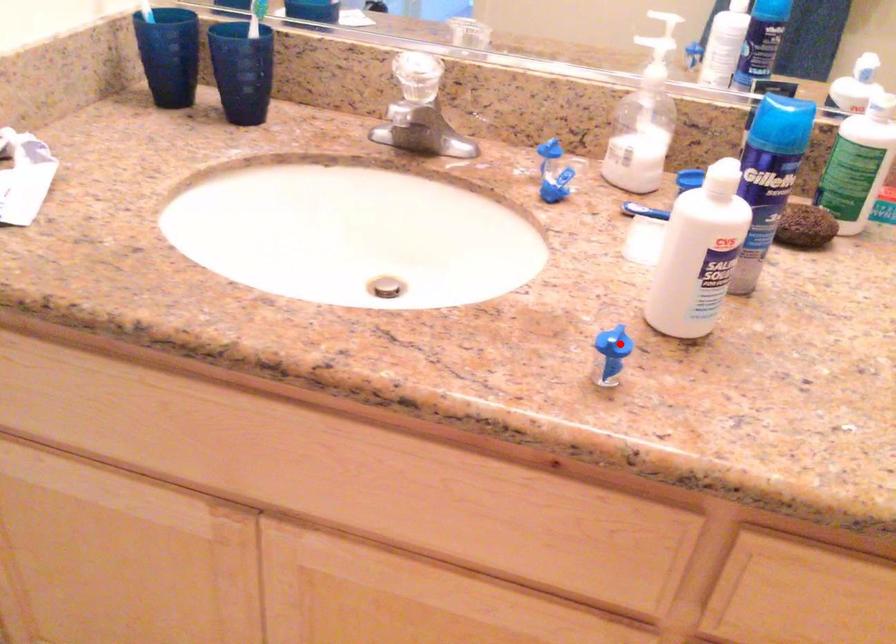
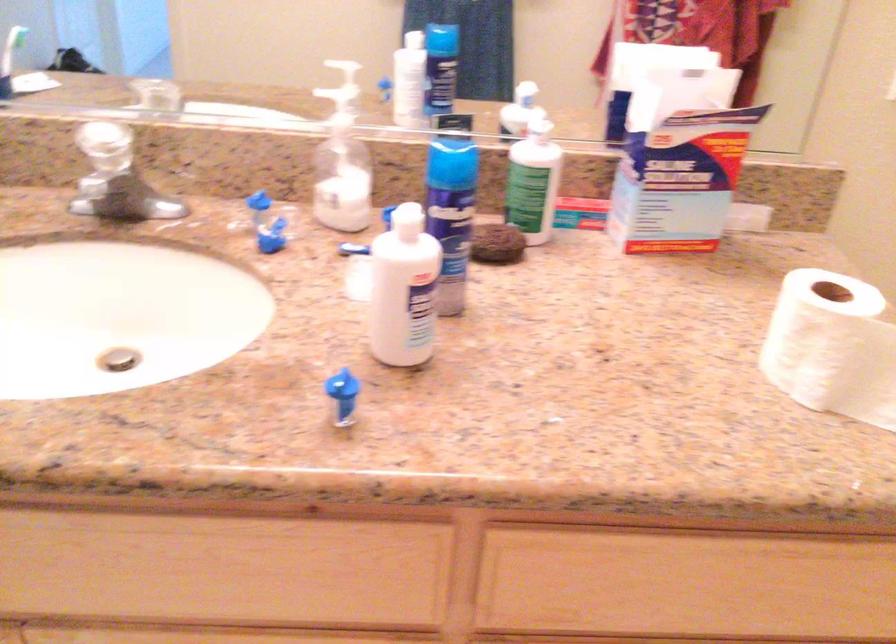
Locate, in the second image, the point that corresponds to the highlighted location in the first image.

(341, 386)